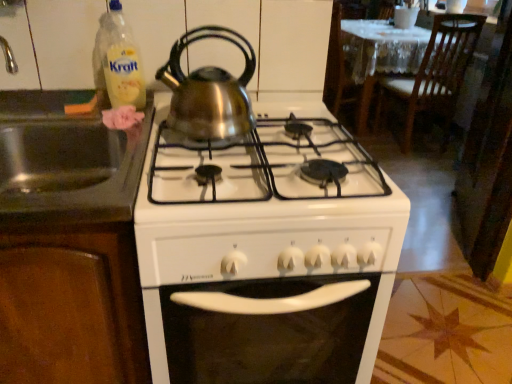
Question: Does stainless steel sink at left have a larger size compared to wooden chair at upper right?

Choices:
 (A) no
 (B) yes

Answer: (A)

Question: Considering the relative sizes of stainless steel sink at left and wooden chair at upper right in the image provided, is stainless steel sink at left thinner than wooden chair at upper right?

Choices:
 (A) no
 (B) yes

Answer: (A)

Question: Does stainless steel sink at left come in front of wooden chair at upper right?

Choices:
 (A) yes
 (B) no

Answer: (A)

Question: Is wooden chair at upper right surrounded by stainless steel sink at left?

Choices:
 (A) no
 (B) yes

Answer: (A)

Question: Can we say stainless steel sink at left lies outside wooden chair at upper right?

Choices:
 (A) no
 (B) yes

Answer: (B)

Question: Looking at the image, does translucent plastic bottle at upper left seem bigger or smaller compared to stainless steel sink at left?

Choices:
 (A) small
 (B) big

Answer: (A)

Question: Does point (135, 59) appear closer or farther from the camera than point (141, 150)?

Choices:
 (A) farther
 (B) closer

Answer: (A)

Question: From the image's perspective, is translucent plastic bottle at upper left positioned above or below stainless steel sink at left?

Choices:
 (A) above
 (B) below

Answer: (A)

Question: Considering their positions, is translucent plastic bottle at upper left located in front of or behind stainless steel sink at left?

Choices:
 (A) front
 (B) behind

Answer: (B)

Question: Considering the positions of point (126, 79) and point (199, 26), is point (126, 79) closer or farther from the camera than point (199, 26)?

Choices:
 (A) farther
 (B) closer

Answer: (B)

Question: From the image's perspective, is translucent plastic bottle at upper left located above or below satin silver kettle at upper center?

Choices:
 (A) above
 (B) below

Answer: (A)

Question: Is translucent plastic bottle at upper left in front of or behind satin silver kettle at upper center in the image?

Choices:
 (A) behind
 (B) front

Answer: (A)

Question: Considering the positions of translucent plastic bottle at upper left and satin silver kettle at upper center in the image, is translucent plastic bottle at upper left wider or thinner than satin silver kettle at upper center?

Choices:
 (A) thin
 (B) wide

Answer: (A)

Question: From the image's perspective, is satin silver kettle at upper center above or below wooden chair at upper right?

Choices:
 (A) below
 (B) above

Answer: (A)

Question: Is point pyautogui.click(x=236, y=33) positioned closer to the camera than point pyautogui.click(x=401, y=79)?

Choices:
 (A) farther
 (B) closer

Answer: (B)